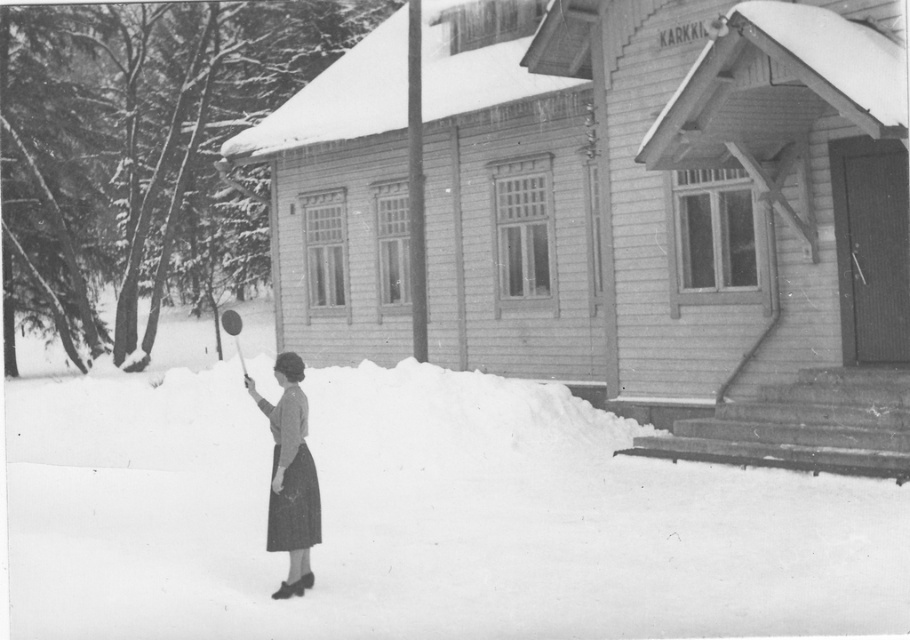
Is white fluffy snow at lower left smaller than smooth gray dress at lower left?

No, white fluffy snow at lower left is not smaller than smooth gray dress at lower left.

Can you confirm if white fluffy snow at lower left is positioned to the right of smooth gray dress at lower left?

No, white fluffy snow at lower left is not to the right of smooth gray dress at lower left.

Is point (408, 412) closer to viewer compared to point (263, 403)?

No, (408, 412) is behind (263, 403).

The image size is (910, 640). I want to click on white fluffy snow at lower left, so click(420, 518).